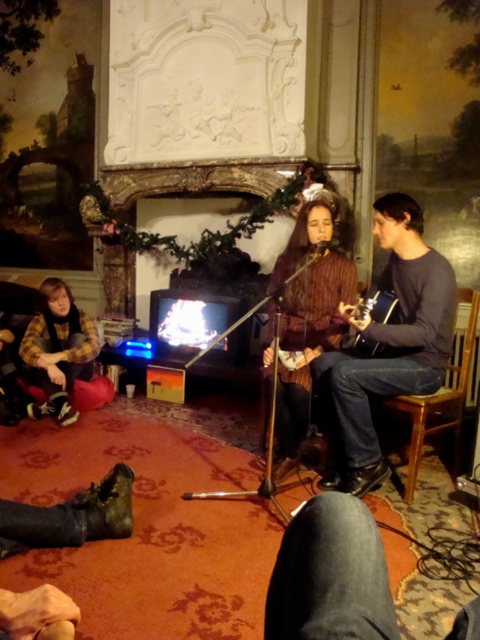
Does point (382, 365) lie behind point (311, 243)?

No.

Does point (408, 291) come farther from viewer compared to point (299, 362)?

No.

Image resolution: width=480 pixels, height=640 pixels. What are the coordinates of `brown textured sweater at center` in the screenshot? It's located at (387, 346).

Does striped sweater at center appear on the left side of wooden acoustic guitar at center?

Yes, striped sweater at center is to the left of wooden acoustic guitar at center.

Which is in front, point (282, 276) or point (347, 348)?

Point (347, 348)

Is point (328, 252) in front of point (363, 349)?

That is False.

At what (x,y) coordinates should I click in order to perform the action: click on striped sweater at center. Please return your answer as a coordinate pair (x, y). Looking at the image, I should click on (308, 344).

Measure the distance between brown textured sweater at center and camera.

A distance of 8.63 feet exists between brown textured sweater at center and camera.

Is brown textured sweater at center wider than flannel shirt at lower left?

Yes, brown textured sweater at center is wider than flannel shirt at lower left.

Measure the distance between point (334, 481) and camera.

Point (334, 481) and camera are 9.57 feet apart.

This screenshot has height=640, width=480. In order to click on brown textured sweater at center in this screenshot , I will do (387, 346).